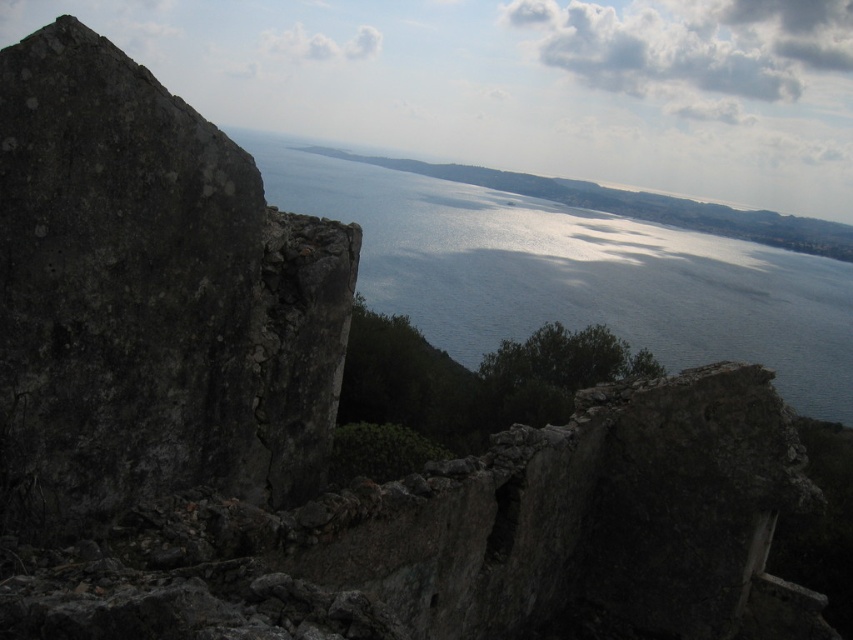
You are a hiker standing at the edge of the scenic viewpoint. You see the dark gray stone at left and the shiny blue water at center. Which object is positioned to the left of the other?

The dark gray stone at left is to the left of the shiny blue water at center.

You are standing at the vantage point overlooking the scene. Which object is closer to you between the dark gray stone at left and the shiny blue water at center?

The dark gray stone at left is closer to you than the shiny blue water at center.

You are standing at the camera position overlooking the scenic view. There is a dark gray stone at left. Can you reach it within 10 seconds if you walk at a normal pace of 3 feet per second?

The dark gray stone at left is 40.48 feet away. At a normal walking pace of 3 feet per second, it would take approximately 13.5 seconds to reach it, which is longer than 10 seconds. Therefore, you cannot reach it within the time limit.